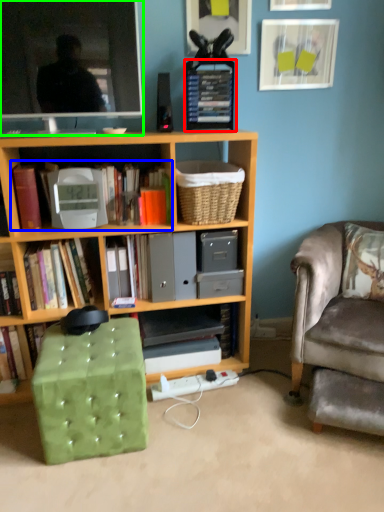
Question: Estimate the real-world distances between objects in this image. Which object is farther from paperback book (highlighted by a red box), book (highlighted by a blue box) or television (highlighted by a green box)?

Choices:
 (A) book
 (B) television

Answer: (A)